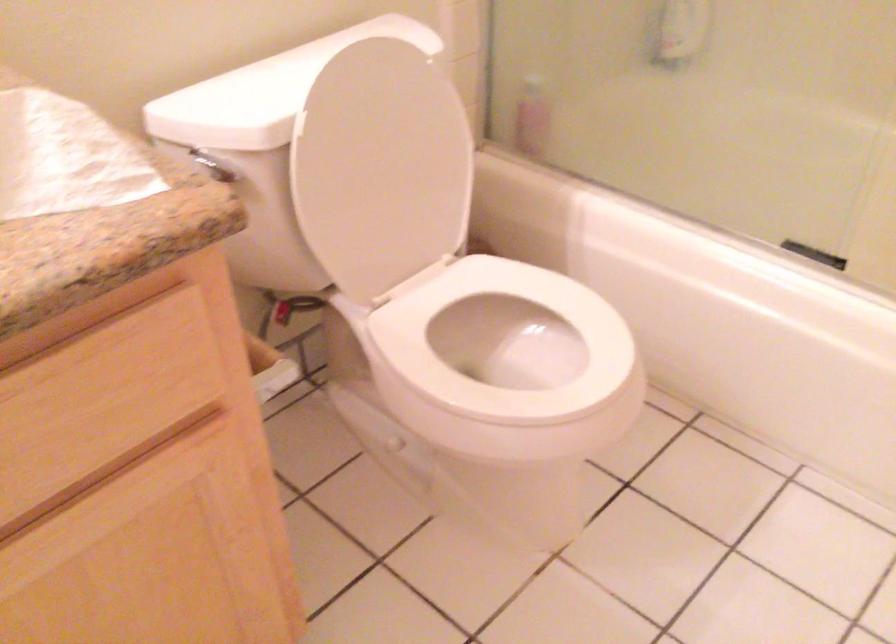
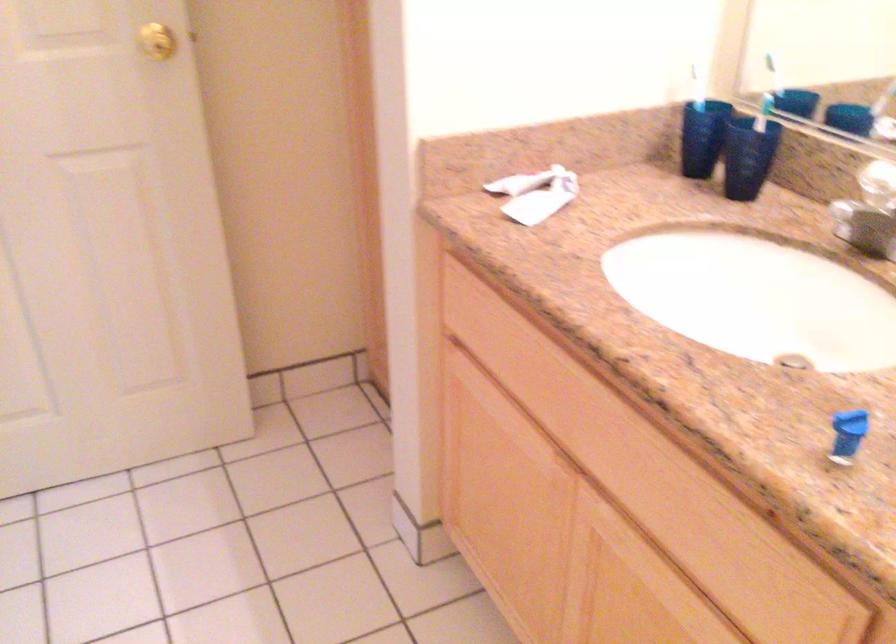
The first image is from the beginning of the video and the second image is from the end. How did the camera likely rotate when shooting the video?

The camera rotated toward left-down.